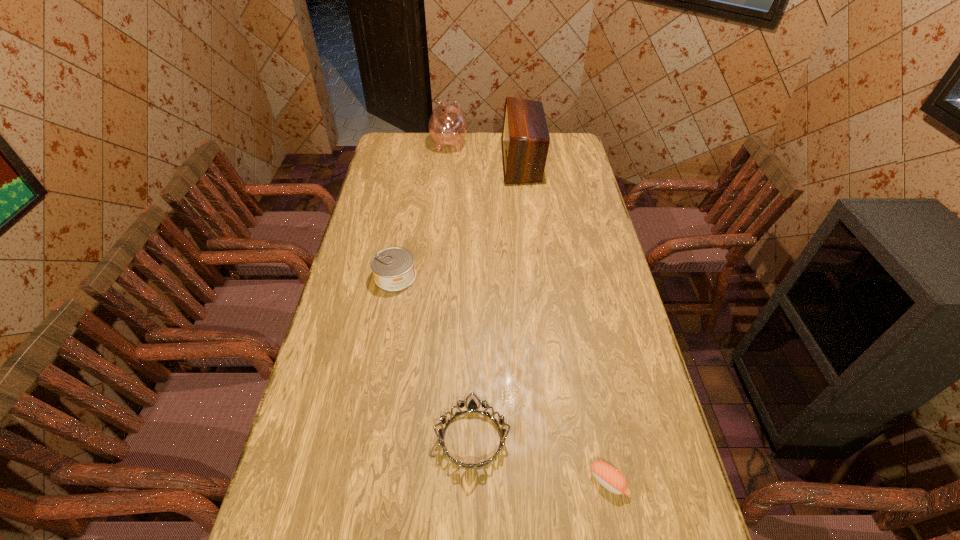
The image size is (960, 540). Find the location of `vacant space situated on the left of the shortest object`. vacant space situated on the left of the shortest object is located at coordinates (540, 482).

This screenshot has width=960, height=540. Identify the location of radio receiver that is positioned at the far edge. (525, 141).

Identify the location of piggy bank that is at the far edge. (448, 125).

What are the coordinates of `object that is positioned at the left edge` in the screenshot? It's located at (394, 270).

At what (x,y) coordinates should I click in order to perform the action: click on object that is at the right edge. Please return your answer as a coordinate pair (x, y). This screenshot has height=540, width=960. Looking at the image, I should click on (609, 477).

The width and height of the screenshot is (960, 540). I want to click on vacant region at the far edge, so click(x=501, y=150).

This screenshot has height=540, width=960. In the image, there is a desktop. Identify the location of vacant space at the left edge. (394, 217).

At what (x,y) coordinates should I click in order to perform the action: click on vacant area at the right edge. Please return your answer as a coordinate pair (x, y). Looking at the image, I should click on (579, 288).

Find the location of a particular element. vacant region at the far right corner is located at coordinates (549, 151).

Where is `unoccupied position between the tiara and the sushi`? The image size is (960, 540). unoccupied position between the tiara and the sushi is located at coordinates (540, 460).